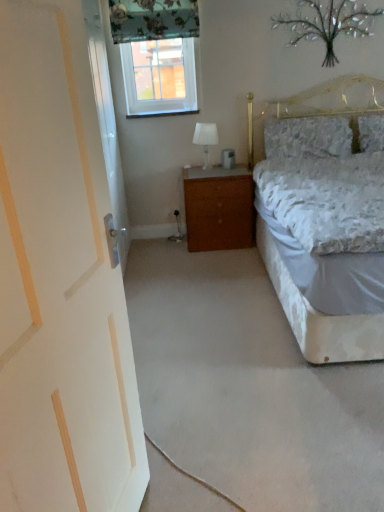
Question: Is fluffy white pillow at upper right, acting as the 2th pillow starting from the right, bigger than white glass table lamp at center?

Choices:
 (A) no
 (B) yes

Answer: (B)

Question: Does fluffy white pillow at upper right, acting as the 2th pillow starting from the right, have a greater width compared to white glass table lamp at center?

Choices:
 (A) yes
 (B) no

Answer: (A)

Question: From a real-world perspective, is fluffy white pillow at upper right, positioned as the 1th pillow in left-to-right order, beneath white glass table lamp at center?

Choices:
 (A) yes
 (B) no

Answer: (B)

Question: From the image's perspective, is fluffy white pillow at upper right, acting as the 2th pillow starting from the right, over white glass table lamp at center?

Choices:
 (A) yes
 (B) no

Answer: (A)

Question: Can you confirm if fluffy white pillow at upper right, acting as the 2th pillow starting from the right, is shorter than white glass table lamp at center?

Choices:
 (A) yes
 (B) no

Answer: (B)

Question: Is point (380, 124) closer or farther from the camera than point (299, 145)?

Choices:
 (A) closer
 (B) farther

Answer: (B)

Question: From the image's perspective, is fluffy white pillow at upper right, which appears as the second pillow when viewed from the left, located above or below fluffy white pillow at upper right, acting as the 2th pillow starting from the right?

Choices:
 (A) below
 (B) above

Answer: (B)

Question: Considering the positions of fluffy white pillow at upper right, the first pillow positioned from the right, and fluffy white pillow at upper right, positioned as the 1th pillow in left-to-right order, in the image, is fluffy white pillow at upper right, the first pillow positioned from the right, bigger or smaller than fluffy white pillow at upper right, positioned as the 1th pillow in left-to-right order,?

Choices:
 (A) big
 (B) small

Answer: (B)

Question: In the image, is fluffy white pillow at upper right, which appears as the second pillow when viewed from the left, on the left side or the right side of fluffy white pillow at upper right, positioned as the 1th pillow in left-to-right order?

Choices:
 (A) right
 (B) left

Answer: (A)

Question: In terms of height, does white glossy door at left look taller or shorter compared to white painted wood door at left?

Choices:
 (A) tall
 (B) short

Answer: (A)

Question: From a real-world perspective, is white glossy door at left physically located above or below white painted wood door at left?

Choices:
 (A) below
 (B) above

Answer: (B)

Question: Based on their positions, is white glossy door at left located to the left or right of white painted wood door at left?

Choices:
 (A) right
 (B) left

Answer: (B)

Question: Do you think white glossy door at left is within white painted wood door at left, or outside of it?

Choices:
 (A) inside
 (B) outside

Answer: (B)

Question: Considering the positions of wooden nightstand at center and metallic silver tree at upper center in the image, is wooden nightstand at center wider or thinner than metallic silver tree at upper center?

Choices:
 (A) thin
 (B) wide

Answer: (B)

Question: Based on their sizes in the image, would you say wooden nightstand at center is bigger or smaller than metallic silver tree at upper center?

Choices:
 (A) big
 (B) small

Answer: (A)